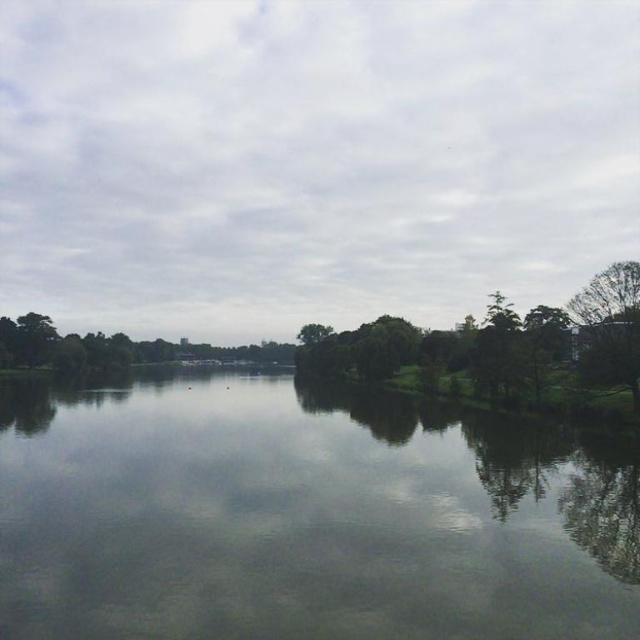
You are a photographer trying to capture the reflection of the green leafy trees at center in the clear water at center. Given that the width of the water is narrower than the trees, will the entire reflection of the trees be visible in the water?

The clear water at center has a width less than the green leafy trees at center, so the entire reflection of the green leafy trees at center may not be fully visible in the water due to the water being narrower.

You are an environmental scientist analyzing the lake ecosystem. You observe the green leafy trees at center and the green leafy tree at right. Which of these contributes more to the shading of the lake surface?

The green leafy trees at center contributes more to the shading of the lake surface because it is larger in size than the green leafy tree at right.